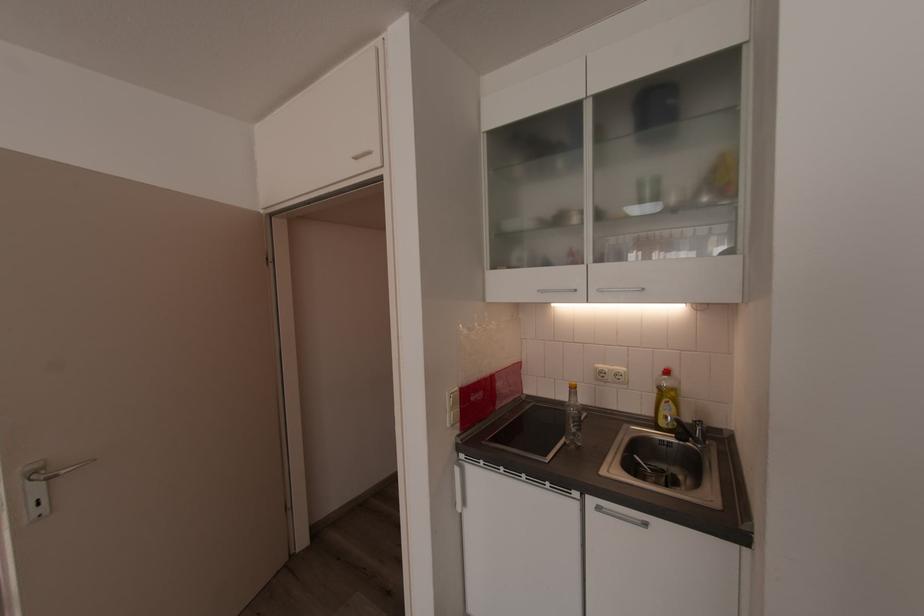
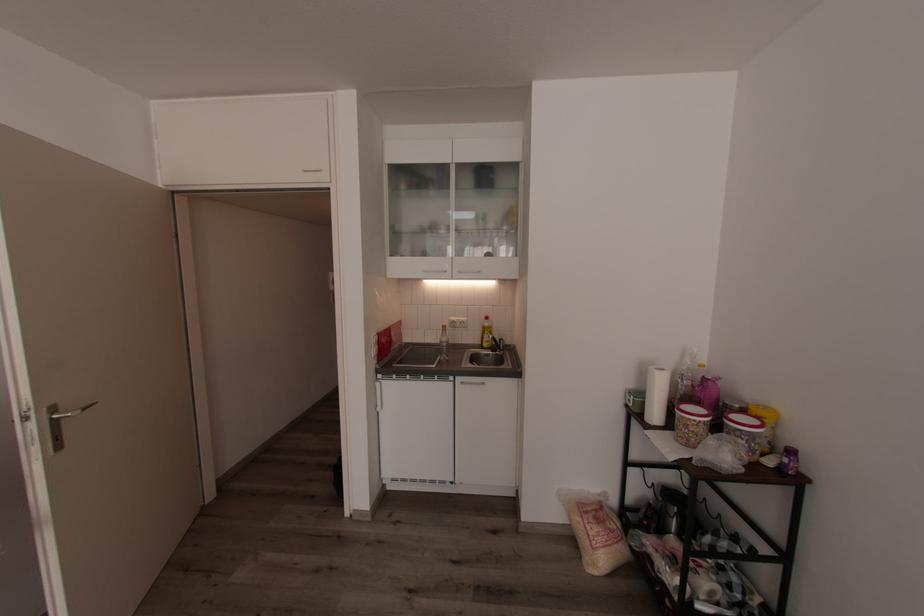
Where in the second image is the point corresponding to point (648, 290) from the first image?

(484, 272)